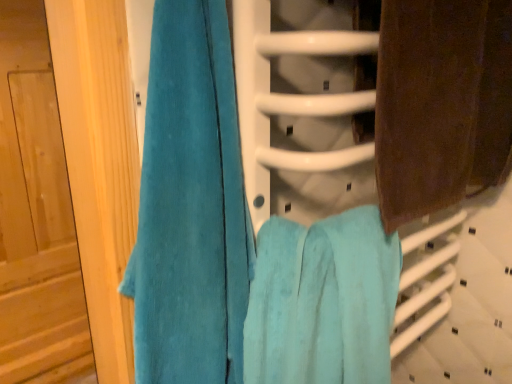
Identify the location of turquoise soft towel at center, the 2th towel when ordered from left to right. (322, 301).

Describe the element at coordinates (36, 214) in the screenshot. I see `wooden door at left` at that location.

I want to click on teal plush towel at left, which is the third towel in right-to-left order, so click(x=191, y=206).

The image size is (512, 384). Identify the location of turquoise soft towel at center, the 2th towel when ordered from left to right. (322, 301).

In the scene shown: Is wooden door at left turned away from turquoise soft towel at center, the 2th towel when ordered from left to right?

No, wooden door at left is not facing the opposite direction of turquoise soft towel at center, the 2th towel when ordered from left to right.

Is wooden door at left bigger than turquoise soft towel at center, the 2th towel when ordered from left to right?

Correct, wooden door at left is larger in size than turquoise soft towel at center, the 2th towel when ordered from left to right.

Who is more distant, wooden door at left or turquoise soft towel at center, the 2th towel when ordered from left to right?

wooden door at left is behind.

Does wooden door at left contain turquoise soft towel at center, the 2th towel when ordered from left to right?

No, turquoise soft towel at center, the 2th towel when ordered from left to right, is located outside of wooden door at left.

Between teal plush towel at left, which is the third towel in right-to-left order, and turquoise soft towel at center, positioned as the second towel in right-to-left order, which one has larger size?

turquoise soft towel at center, positioned as the second towel in right-to-left order.

Are teal plush towel at left, which is the third towel in right-to-left order, and turquoise soft towel at center, positioned as the second towel in right-to-left order, making contact?

No, teal plush towel at left, which is the third towel in right-to-left order, is not next to turquoise soft towel at center, positioned as the second towel in right-to-left order.

Is teal plush towel at left, which is the third towel in right-to-left order, closer to camera compared to turquoise soft towel at center, positioned as the second towel in right-to-left order?

Yes, the depth of teal plush towel at left, which is the third towel in right-to-left order, is less than that of turquoise soft towel at center, positioned as the second towel in right-to-left order.

What's the angular difference between teal plush towel at left, the first towel positioned from the left, and turquoise soft towel at center, the 2th towel when ordered from left to right,'s facing directions?

The angle between the facing direction of teal plush towel at left, the first towel positioned from the left, and the facing direction of turquoise soft towel at center, the 2th towel when ordered from left to right, is 0.00128 degrees.

Considering the sizes of objects teal plush towel at left, the first towel positioned from the left, and brown textured towel at right, acting as the 3th towel starting from the left, in the image provided, who is smaller, teal plush towel at left, the first towel positioned from the left, or brown textured towel at right, acting as the 3th towel starting from the left,?

Smaller between the two is teal plush towel at left, the first towel positioned from the left.

From the image's perspective, would you say teal plush towel at left, the first towel positioned from the left, is shown under brown textured towel at right, the first towel when ordered from right to left?

Yes.

Which is more to the left, teal plush towel at left, which is the third towel in right-to-left order, or brown textured towel at right, acting as the 3th towel starting from the left?

Positioned to the left is teal plush towel at left, which is the third towel in right-to-left order.

Is turquoise soft towel at center, positioned as the second towel in right-to-left order, wider or thinner than wooden door at left?

turquoise soft towel at center, positioned as the second towel in right-to-left order, is wider than wooden door at left.

Is turquoise soft towel at center, the 2th towel when ordered from left to right, beside wooden door at left?

No.

From their relative heights in the image, would you say turquoise soft towel at center, positioned as the second towel in right-to-left order, is taller or shorter than brown textured towel at right, acting as the 3th towel starting from the left?

Considering their sizes, turquoise soft towel at center, positioned as the second towel in right-to-left order, has more height than brown textured towel at right, acting as the 3th towel starting from the left.

Are turquoise soft towel at center, positioned as the second towel in right-to-left order, and brown textured towel at right, the first towel when ordered from right to left, located far from each other?

No, turquoise soft towel at center, positioned as the second towel in right-to-left order, is not far from brown textured towel at right, the first towel when ordered from right to left.

In the scene shown: Does turquoise soft towel at center, positioned as the second towel in right-to-left order, appear on the left side of brown textured towel at right, the first towel when ordered from right to left?

Correct, you'll find turquoise soft towel at center, positioned as the second towel in right-to-left order, to the left of brown textured towel at right, the first towel when ordered from right to left.

From the image's perspective, which object appears higher, turquoise soft towel at center, positioned as the second towel in right-to-left order, or brown textured towel at right, the first towel when ordered from right to left?

brown textured towel at right, the first towel when ordered from right to left, is shown above in the image.

Locate an element on the screen. This screenshot has height=384, width=512. door lying on the left of teal plush towel at left, which is the third towel in right-to-left order is located at coordinates (36, 214).

Is teal plush towel at left, which is the third towel in right-to-left order, inside wooden door at left?

No, teal plush towel at left, which is the third towel in right-to-left order, is not inside wooden door at left.

Considering the relative positions of wooden door at left and teal plush towel at left, the first towel positioned from the left, in the image provided, is wooden door at left in front of teal plush towel at left, the first towel positioned from the left,?

No, it is behind teal plush towel at left, the first towel positioned from the left.

From the image's perspective, would you say wooden door at left is positioned over teal plush towel at left, the first towel positioned from the left?

No, from the image's perspective, wooden door at left is not above teal plush towel at left, the first towel positioned from the left.

From the image's perspective, relative to wooden door at left, is brown textured towel at right, acting as the 3th towel starting from the left, above or below?

From the image's perspective, brown textured towel at right, acting as the 3th towel starting from the left, appears above wooden door at left.

Can you confirm if brown textured towel at right, the first towel when ordered from right to left, is taller than wooden door at left?

No, brown textured towel at right, the first towel when ordered from right to left, is not taller than wooden door at left.

Considering the points (505, 45) and (74, 315), which point is behind, point (505, 45) or point (74, 315)?

The point (74, 315) is more distant.

Considering the relative sizes of brown textured towel at right, the first towel when ordered from right to left, and wooden door at left in the image provided, is brown textured towel at right, the first towel when ordered from right to left, thinner than wooden door at left?

Yes, brown textured towel at right, the first towel when ordered from right to left, is thinner than wooden door at left.

Find the location of a particular element. This screenshot has height=384, width=512. door located above the turquoise soft towel at center, positioned as the second towel in right-to-left order (from the image's perspective) is located at coordinates (36, 214).

Image resolution: width=512 pixels, height=384 pixels. Identify the location of the 1st towel behind the teal plush towel at left, which is the third towel in right-to-left order. (322, 301).

Based on their spatial positions, is turquoise soft towel at center, positioned as the second towel in right-to-left order, or brown textured towel at right, acting as the 3th towel starting from the left, closer to wooden door at left?

turquoise soft towel at center, positioned as the second towel in right-to-left order, is closer to wooden door at left.

From the image, which object appears to be nearer to brown textured towel at right, the first towel when ordered from right to left, turquoise soft towel at center, the 2th towel when ordered from left to right, or wooden door at left?

The object closer to brown textured towel at right, the first towel when ordered from right to left, is turquoise soft towel at center, the 2th towel when ordered from left to right.

Based on their spatial positions, is turquoise soft towel at center, the 2th towel when ordered from left to right, or brown textured towel at right, acting as the 3th towel starting from the left, further from teal plush towel at left, the first towel positioned from the left?

brown textured towel at right, acting as the 3th towel starting from the left, is further to teal plush towel at left, the first towel positioned from the left.

Which object lies further to the anchor point turquoise soft towel at center, positioned as the second towel in right-to-left order, wooden door at left or brown textured towel at right, acting as the 3th towel starting from the left?

Based on the image, wooden door at left appears to be further to turquoise soft towel at center, positioned as the second towel in right-to-left order.

Considering their positions, is wooden door at left positioned further to turquoise soft towel at center, positioned as the second towel in right-to-left order, than teal plush towel at left, the first towel positioned from the left?

wooden door at left is positioned further to the anchor turquoise soft towel at center, positioned as the second towel in right-to-left order.

Which object lies nearer to the anchor point teal plush towel at left, which is the third towel in right-to-left order, wooden door at left or turquoise soft towel at center, the 2th towel when ordered from left to right?

The object closer to teal plush towel at left, which is the third towel in right-to-left order, is turquoise soft towel at center, the 2th towel when ordered from left to right.

In the scene shown: Considering their positions, is wooden door at left positioned closer to brown textured towel at right, acting as the 3th towel starting from the left, than turquoise soft towel at center, positioned as the second towel in right-to-left order?

turquoise soft towel at center, positioned as the second towel in right-to-left order, is closer to brown textured towel at right, acting as the 3th towel starting from the left.

Based on their spatial positions, is turquoise soft towel at center, positioned as the second towel in right-to-left order, or teal plush towel at left, which is the third towel in right-to-left order, closer to wooden door at left?

teal plush towel at left, which is the third towel in right-to-left order, is closer to wooden door at left.

This screenshot has height=384, width=512. I want to click on towel located between teal plush towel at left, the first towel positioned from the left, and brown textured towel at right, the first towel when ordered from right to left, in the left-right direction, so click(322, 301).

Image resolution: width=512 pixels, height=384 pixels. I want to click on towel located between wooden door at left and turquoise soft towel at center, positioned as the second towel in right-to-left order, in the left-right direction, so (191, 206).